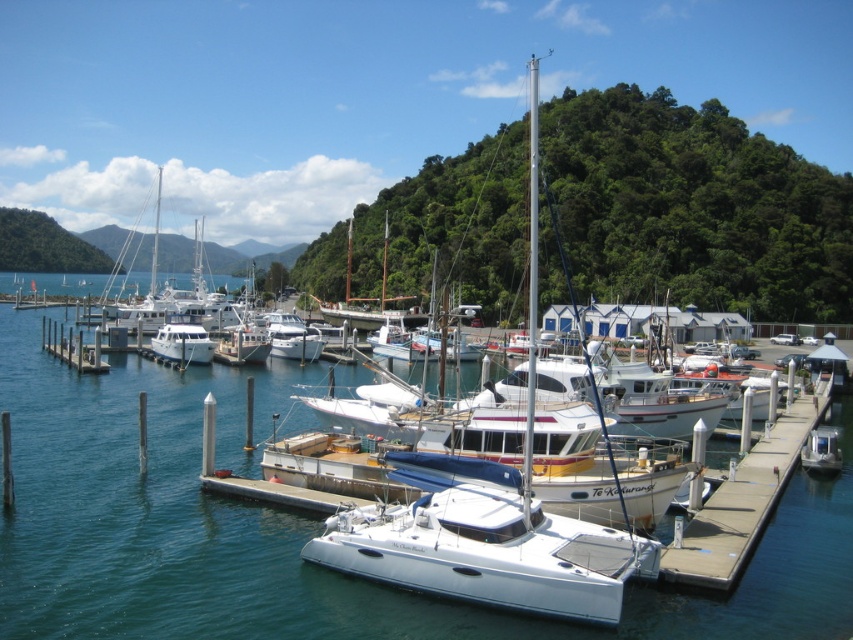
You are a photographer planning to capture the reflection of the white glossy boat at center in the white glossy water at center. Based on the scene, can you determine if the water surface is wide enough to fully reflect the boat?

The white glossy water at center has a larger width than the white glossy boat at center, so yes, the water surface is wide enough to fully reflect the boat.

You are a dock worker who needs to secure a new boat. You have a rope that is 5 meters long. Can you safely tie the white glossy boat at center to the white wooden dock at left using this rope?

The distance between the white glossy boat at center and the white wooden dock at left is 5.71 meters. Since the rope is only 5 meters long, it is not long enough to reach safely. You would need a longer rope to secure the boat properly.